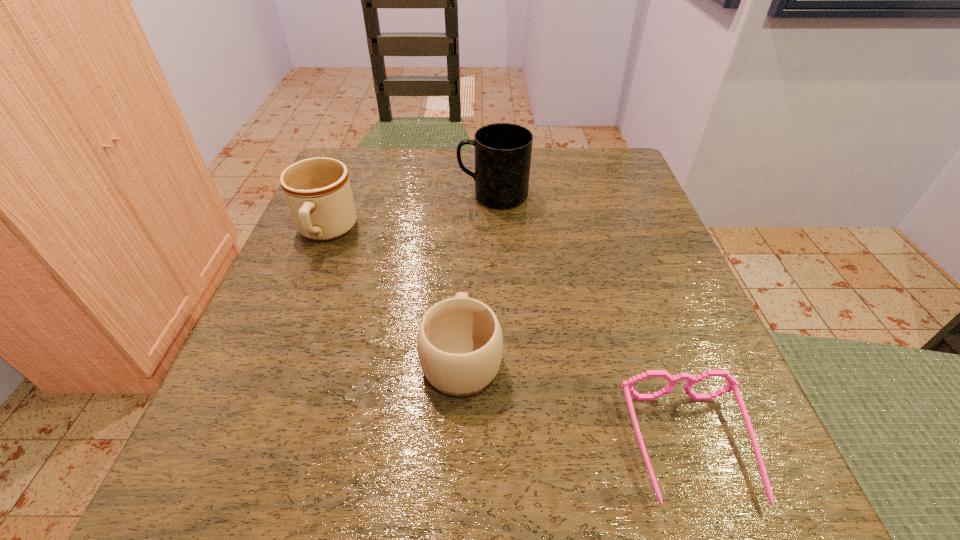
In the image, there is a desktop. Where is `free region at the far right corner`? free region at the far right corner is located at coordinates (607, 195).

This screenshot has width=960, height=540. What are the coordinates of `vacant space at the near right corner of the desktop` in the screenshot? It's located at (763, 490).

Where is `unoccupied position between the third tallest object and the spectacles`? The width and height of the screenshot is (960, 540). unoccupied position between the third tallest object and the spectacles is located at coordinates (576, 402).

Where is `vacant space that is in between the shortest mug and the shortest object`? The width and height of the screenshot is (960, 540). vacant space that is in between the shortest mug and the shortest object is located at coordinates (576, 402).

Identify the location of vacant space that is in between the second tallest object and the spectacles. (508, 340).

At what (x,y) coordinates should I click in order to perform the action: click on empty space between the shortest object and the third tallest object. Please return your answer as a coordinate pair (x, y). Image resolution: width=960 pixels, height=540 pixels. Looking at the image, I should click on (576, 402).

You are a GUI agent. You are given a task and a screenshot of the screen. Output one action in this format:
    pyautogui.click(x=<x>, y=<y>)
    Task: Click on the free space that is in between the leftmost mug and the shortest object
    This screenshot has width=960, height=540.
    Given the screenshot: What is the action you would take?
    pyautogui.click(x=508, y=340)

You are a GUI agent. You are given a task and a screenshot of the screen. Output one action in this format:
    pyautogui.click(x=<x>, y=<y>)
    Task: Click on the free spot between the leftmost mug and the spectacles
    
    Given the screenshot: What is the action you would take?
    pyautogui.click(x=508, y=340)

Where is `object identified as the second closest to the nearest mug`? This screenshot has width=960, height=540. object identified as the second closest to the nearest mug is located at coordinates (318, 192).

At what (x,y) coordinates should I click in order to perform the action: click on object that stands as the second closest to the shortest mug. Please return your answer as a coordinate pair (x, y). Looking at the image, I should click on (318, 192).